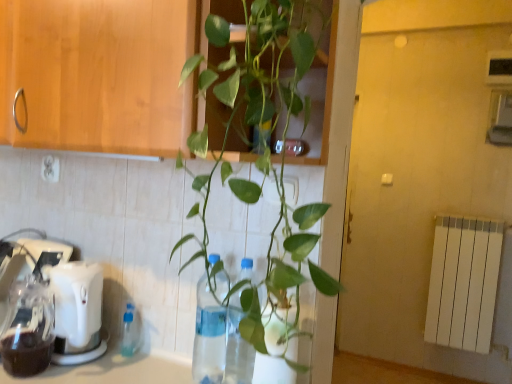
Find the location of `white plastic coffee machine at lower left`. white plastic coffee machine at lower left is located at coordinates (77, 312).

What do you see at coordinates (209, 337) in the screenshot?
I see `clear plastic bottle at center, the second bottle positioned from the back` at bounding box center [209, 337].

What is the approximate height of transparent plastic bottle at center?

It is 12.82 inches.

Where is `white plastic coffee machine at lower left`? This screenshot has width=512, height=384. white plastic coffee machine at lower left is located at coordinates coord(77,312).

Which is more to the left, white plastic coffee machine at lower left or clear plastic bottle at center, positioned as the 1th bottle in front-to-back order?

white plastic coffee machine at lower left is more to the left.

Does white plastic coffee machine at lower left contain clear plastic bottle at center, which appears as the second bottle when viewed from the left?

Actually, clear plastic bottle at center, which appears as the second bottle when viewed from the left, is outside white plastic coffee machine at lower left.

Who is taller, white plastic coffee machine at lower left or clear plastic bottle at center, positioned as the 1th bottle in front-to-back order?

Standing taller between the two is clear plastic bottle at center, positioned as the 1th bottle in front-to-back order.

How distant is white plastic coffee machine at lower left from clear plastic bottle at center, which appears as the second bottle when viewed from the left?

white plastic coffee machine at lower left and clear plastic bottle at center, which appears as the second bottle when viewed from the left, are 12.85 inches apart.

How many degrees apart are the facing directions of transparent plastic bottle at lower left, arranged as the 2th bottle when viewed from the right, and clear plastic bottle at center, the second bottle positioned from the back?

0.00508 degrees separate the facing orientations of transparent plastic bottle at lower left, arranged as the 2th bottle when viewed from the right, and clear plastic bottle at center, the second bottle positioned from the back.

Who is shorter, transparent plastic bottle at lower left, the first bottle in the back-to-front sequence, or clear plastic bottle at center, the 1th bottle from the right?

With less height is transparent plastic bottle at lower left, the first bottle in the back-to-front sequence.

Does transparent plastic bottle at lower left, the first bottle in the back-to-front sequence, have a lesser width compared to clear plastic bottle at center, the second bottle positioned from the back?

Yes.

From a real-world perspective, who is located higher, transparent plastic bottle at lower left, arranged as the 2th bottle when viewed from the right, or clear plastic bottle at center, which appears as the second bottle when viewed from the left?

From a 3D spatial view, clear plastic bottle at center, which appears as the second bottle when viewed from the left, is above.

From the image's perspective, does white plastic electric outlet at upper left appear lower than transparent plastic bottle at lower left, arranged as the 2th bottle when viewed from the right?

Actually, white plastic electric outlet at upper left appears above transparent plastic bottle at lower left, arranged as the 2th bottle when viewed from the right, in the image.

Is white plastic electric outlet at upper left positioned beyond the bounds of transparent plastic bottle at lower left, positioned as the 2th bottle in front-to-back order?

That's correct, white plastic electric outlet at upper left is outside of transparent plastic bottle at lower left, positioned as the 2th bottle in front-to-back order.

Is white plastic electric outlet at upper left taller than transparent plastic bottle at lower left, the 1th bottle when ordered from left to right?

No, white plastic electric outlet at upper left is not taller than transparent plastic bottle at lower left, the 1th bottle when ordered from left to right.

In the image, is white plastic electric outlet at upper left on the left side or the right side of transparent plastic bottle at lower left, the first bottle in the back-to-front sequence?

From the image, it's evident that white plastic electric outlet at upper left is to the left of transparent plastic bottle at lower left, the first bottle in the back-to-front sequence.

In terms of height, does white plastic electric outlet at upper left look taller or shorter compared to white plastic mixer at lower left?

white plastic electric outlet at upper left is shorter than white plastic mixer at lower left.

Is white plastic electric outlet at upper left looking in the opposite direction of white plastic mixer at lower left?

No, white plastic mixer at lower left is not at the back of white plastic electric outlet at upper left.

Considering the points (48, 157) and (55, 324), which point is behind, point (48, 157) or point (55, 324)?

The point (48, 157) is farther from the camera.

Considering the relative sizes of white plastic electric outlet at upper left and white plastic mixer at lower left in the image provided, is white plastic electric outlet at upper left wider than white plastic mixer at lower left?

Incorrect, the width of white plastic electric outlet at upper left does not surpass that of white plastic mixer at lower left.

Considering the points (233, 367) and (65, 273), which point is behind, point (233, 367) or point (65, 273)?

The point (233, 367) is farther from the camera.

Is transparent plastic bottle at center shorter than white plastic mixer at lower left?

No.

Looking at the image, does transparent plastic bottle at center seem bigger or smaller compared to white plastic mixer at lower left?

Considering their sizes, transparent plastic bottle at center takes up less space than white plastic mixer at lower left.

Do you think transparent plastic bottle at center is within white plastic mixer at lower left, or outside of it?

transparent plastic bottle at center lies outside white plastic mixer at lower left.

From a real-world perspective, is transparent plastic bottle at center positioned over clear plastic bottle at center, which appears as the second bottle when viewed from the left, based on gravity?

Indeed, from a real-world perspective, transparent plastic bottle at center stands above clear plastic bottle at center, which appears as the second bottle when viewed from the left.

Considering the relative sizes of transparent plastic bottle at center and clear plastic bottle at center, which appears as the second bottle when viewed from the left, in the image provided, is transparent plastic bottle at center taller than clear plastic bottle at center, which appears as the second bottle when viewed from the left,?

Indeed, transparent plastic bottle at center has a greater height compared to clear plastic bottle at center, which appears as the second bottle when viewed from the left.

Which point is more forward, [240,355] or [210,300]?

The point [240,355] is closer.

Considering the relative sizes of transparent plastic bottle at center and clear plastic bottle at center, the second bottle positioned from the back, in the image provided, is transparent plastic bottle at center smaller than clear plastic bottle at center, the second bottle positioned from the back,?

No.

Considering the positions of points (218, 316) and (135, 347), is point (218, 316) closer to camera compared to point (135, 347)?

Yes.

Is there a large distance between clear plastic bottle at center, the 1th bottle from the right, and transparent plastic bottle at lower left, arranged as the 2th bottle when viewed from the right?

No, clear plastic bottle at center, the 1th bottle from the right, is not far away from transparent plastic bottle at lower left, arranged as the 2th bottle when viewed from the right.

Which object is thinner, clear plastic bottle at center, which appears as the second bottle when viewed from the left, or transparent plastic bottle at lower left, arranged as the 2th bottle when viewed from the right?

transparent plastic bottle at lower left, arranged as the 2th bottle when viewed from the right, is thinner.

This screenshot has height=384, width=512. Identify the location of the 2nd bottle counting from the right of the white plastic coffee machine at lower left. click(x=209, y=337).

I want to click on bottle that is on the left side of clear plastic bottle at center, which appears as the second bottle when viewed from the left, so click(x=130, y=331).

When comparing their distances from transparent plastic bottle at lower left, positioned as the 2th bottle in front-to-back order, does transparent plastic bottle at center or white plastic coffee machine at lower left seem closer?

Based on the image, white plastic coffee machine at lower left appears to be nearer to transparent plastic bottle at lower left, positioned as the 2th bottle in front-to-back order.

When comparing their distances from clear plastic bottle at center, positioned as the 1th bottle in front-to-back order, does white plastic mixer at lower left or transparent plastic bottle at lower left, positioned as the 2th bottle in front-to-back order, seem closer?

transparent plastic bottle at lower left, positioned as the 2th bottle in front-to-back order, is positioned closer to the anchor clear plastic bottle at center, positioned as the 1th bottle in front-to-back order.

Considering their positions, is clear plastic bottle at center, positioned as the 1th bottle in front-to-back order, positioned further to white plastic coffee machine at lower left than white plastic mixer at lower left?

Among the two, clear plastic bottle at center, positioned as the 1th bottle in front-to-back order, is located further to white plastic coffee machine at lower left.

When comparing their distances from clear plastic bottle at center, the second bottle positioned from the back, does transparent plastic bottle at center or transparent plastic bottle at lower left, positioned as the 2th bottle in front-to-back order, seem closer?

transparent plastic bottle at center lies closer to clear plastic bottle at center, the second bottle positioned from the back, than the other object.

Looking at this image, looking at the image, which one is located closer to clear plastic bottle at center, which appears as the second bottle when viewed from the left, white plastic electric outlet at upper left or transparent plastic bottle at lower left, positioned as the 2th bottle in front-to-back order?

transparent plastic bottle at lower left, positioned as the 2th bottle in front-to-back order, is closer to clear plastic bottle at center, which appears as the second bottle when viewed from the left.

Which object lies nearer to the anchor point transparent plastic bottle at lower left, positioned as the 2th bottle in front-to-back order, white plastic mixer at lower left or clear plastic bottle at center, which appears as the second bottle when viewed from the left?

white plastic mixer at lower left.

Based on their spatial positions, is clear plastic bottle at center, the second bottle positioned from the back, or transparent plastic bottle at lower left, the first bottle in the back-to-front sequence, further from transparent plastic bottle at center?

The object further to transparent plastic bottle at center is transparent plastic bottle at lower left, the first bottle in the back-to-front sequence.

Considering their positions, is white plastic mixer at lower left positioned closer to white plastic coffee machine at lower left than transparent plastic bottle at lower left, arranged as the 2th bottle when viewed from the right?

white plastic mixer at lower left lies closer to white plastic coffee machine at lower left than the other object.

This screenshot has height=384, width=512. What are the coordinates of `coffee machine between white plastic electric outlet at upper left and transparent plastic bottle at lower left, positioned as the 2th bottle in front-to-back order, in the vertical direction` in the screenshot? It's located at (77, 312).

Find the location of a particular element. bottle located between white plastic coffee machine at lower left and clear plastic bottle at center, positioned as the 1th bottle in front-to-back order, in the left-right direction is located at coordinates (130, 331).

The width and height of the screenshot is (512, 384). Identify the location of coffee machine between white plastic mixer at lower left and transparent plastic bottle at center. (77, 312).

Where is `coffee machine between white plastic mixer at lower left and clear plastic bottle at center, the second bottle positioned from the back, in the horizontal direction`? The image size is (512, 384). coffee machine between white plastic mixer at lower left and clear plastic bottle at center, the second bottle positioned from the back, in the horizontal direction is located at coordinates (77, 312).